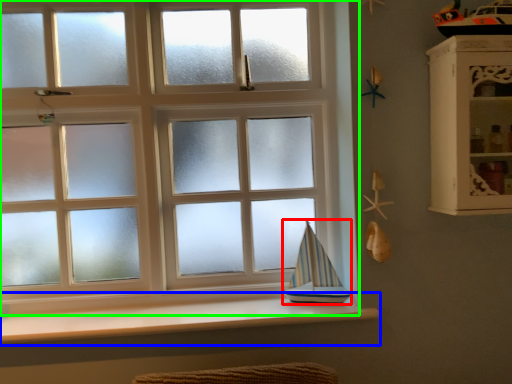
Question: Which object is the farthest from sailboat (highlighted by a red box)? Choose among these: window sill (highlighted by a blue box) or window (highlighted by a green box).

Choices:
 (A) window sill
 (B) window

Answer: (B)